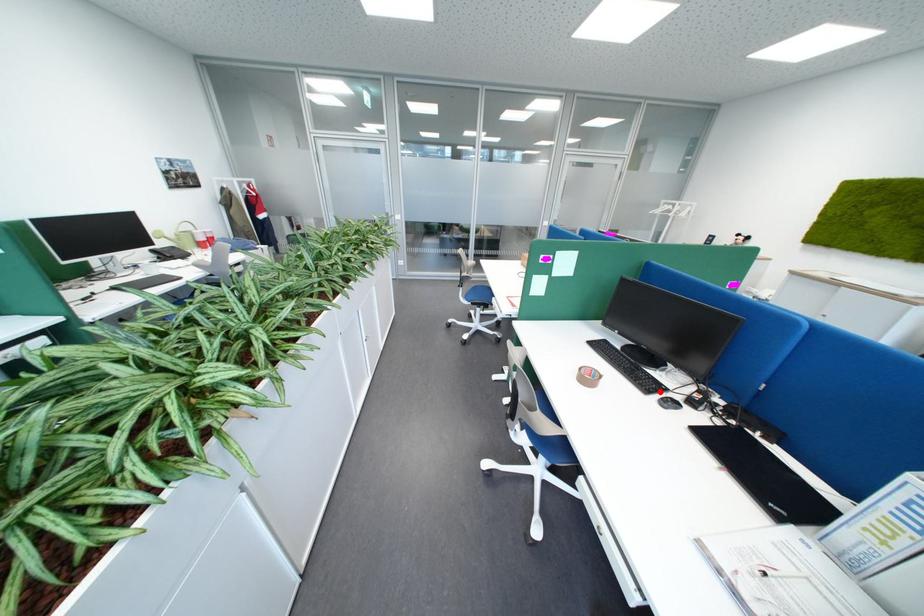
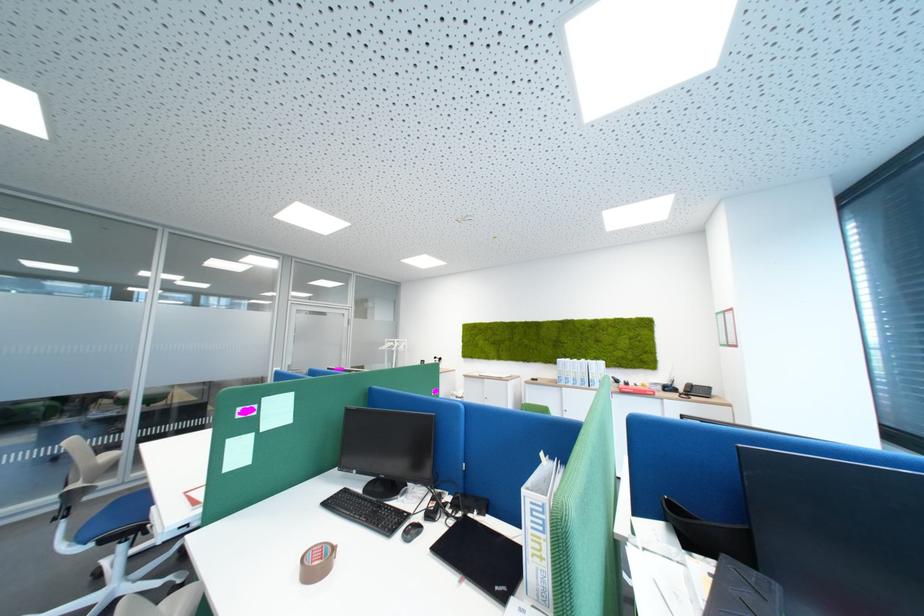
In the second image, find the point that corresponds to the highlighted location in the first image.

(403, 533)